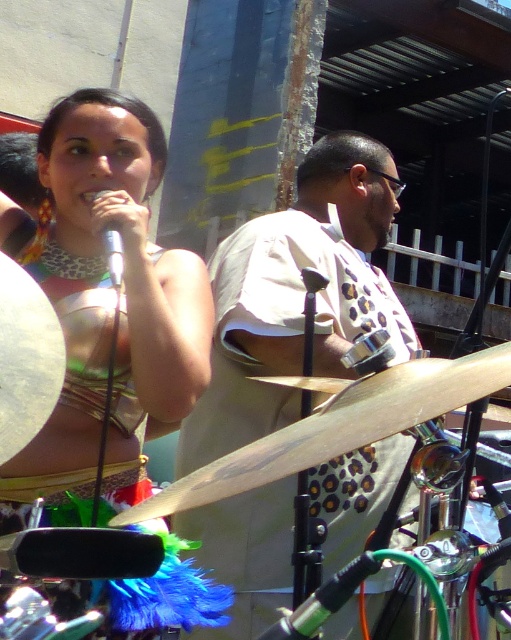
Does matte gold necklace at upper left have a greater height compared to black rubber microphone at center?

Yes, matte gold necklace at upper left is taller than black rubber microphone at center.

Does matte gold necklace at upper left appear on the left side of black rubber microphone at center?

Correct, you'll find matte gold necklace at upper left to the left of black rubber microphone at center.

Is point (104, 102) positioned after point (290, 634)?

That is True.

Identify the location of matte gold necklace at upper left. (124, 266).

Does matte gold necklace at upper left lie behind wooden drum at center?

Yes.

This screenshot has width=511, height=640. I want to click on matte gold necklace at upper left, so click(124, 266).

Locate an element on the screen. matte gold necklace at upper left is located at coordinates (124, 266).

Who is more forward, (450, 369) or (374, 570)?

Point (374, 570) is more forward.

At what (x,y) coordinates should I click in order to perform the action: click on wooden drum at center. Please return your answer as a coordinate pair (x, y). The width and height of the screenshot is (511, 640). Looking at the image, I should click on (337, 428).

Where is `wooden drum at center`? Image resolution: width=511 pixels, height=640 pixels. wooden drum at center is located at coordinates (337, 428).